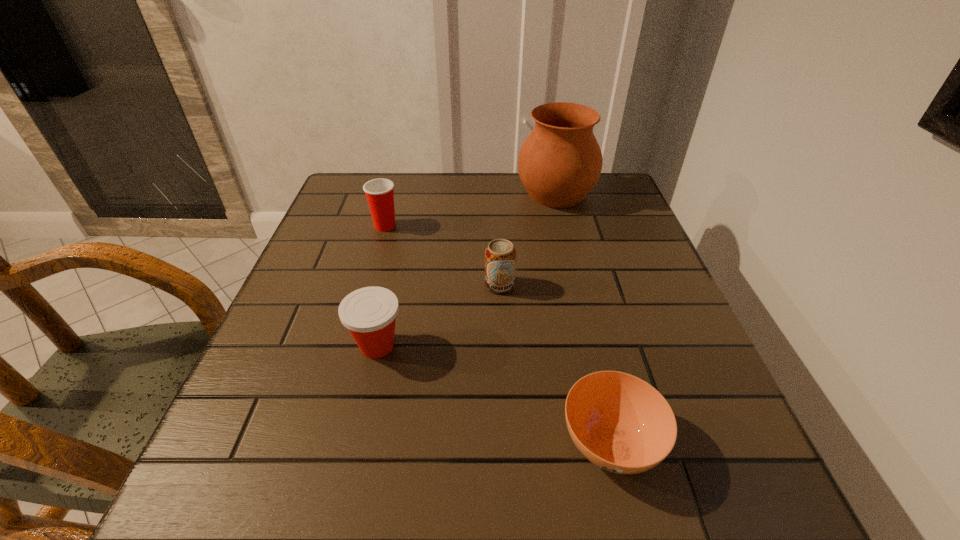
What are the coordinates of `vacant space situated 0.310m on the left of the third object from left to right` in the screenshot? It's located at (342, 285).

Where is `free space located on the right of the fourth farthest object`? This screenshot has height=540, width=960. free space located on the right of the fourth farthest object is located at coordinates (564, 346).

This screenshot has height=540, width=960. Find the location of `blank space located on the left of the nearest object`. blank space located on the left of the nearest object is located at coordinates (333, 442).

Where is `object situated at the far edge`? object situated at the far edge is located at coordinates (559, 163).

This screenshot has width=960, height=540. I want to click on object located in the near edge section of the desktop, so click(622, 424).

You are a GUI agent. You are given a task and a screenshot of the screen. Output one action in this format:
    pyautogui.click(x=<x>, y=<y>)
    Task: Click on the object positioned at the left edge
    The width and height of the screenshot is (960, 540).
    Given the screenshot: What is the action you would take?
    pyautogui.click(x=379, y=192)

Where is `pottery that is at the right edge`? The image size is (960, 540). pottery that is at the right edge is located at coordinates (559, 163).

The height and width of the screenshot is (540, 960). Find the location of `soup bowl that is positioned at the right edge`. soup bowl that is positioned at the right edge is located at coordinates (622, 424).

Where is `object that is at the far right corner`? The image size is (960, 540). object that is at the far right corner is located at coordinates (559, 163).

This screenshot has height=540, width=960. Find the location of `object present at the near right corner`. object present at the near right corner is located at coordinates tap(622, 424).